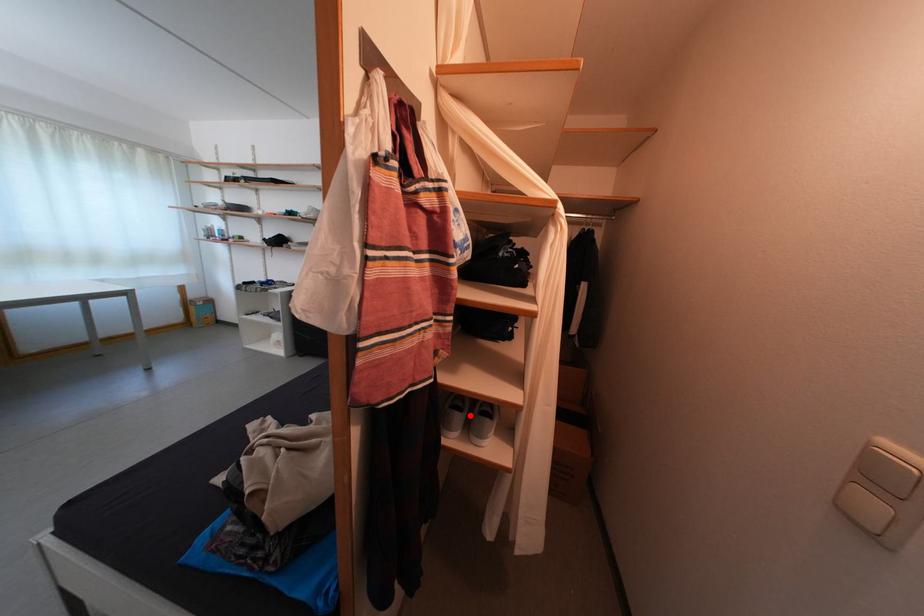
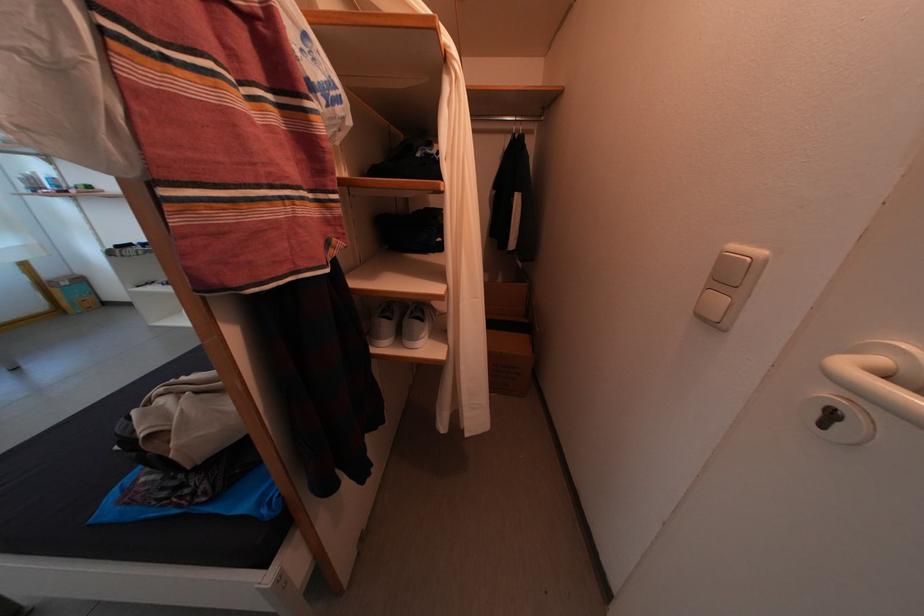
The point at the highlighted location is marked in the first image. Where is the corresponding point in the second image?

(398, 323)